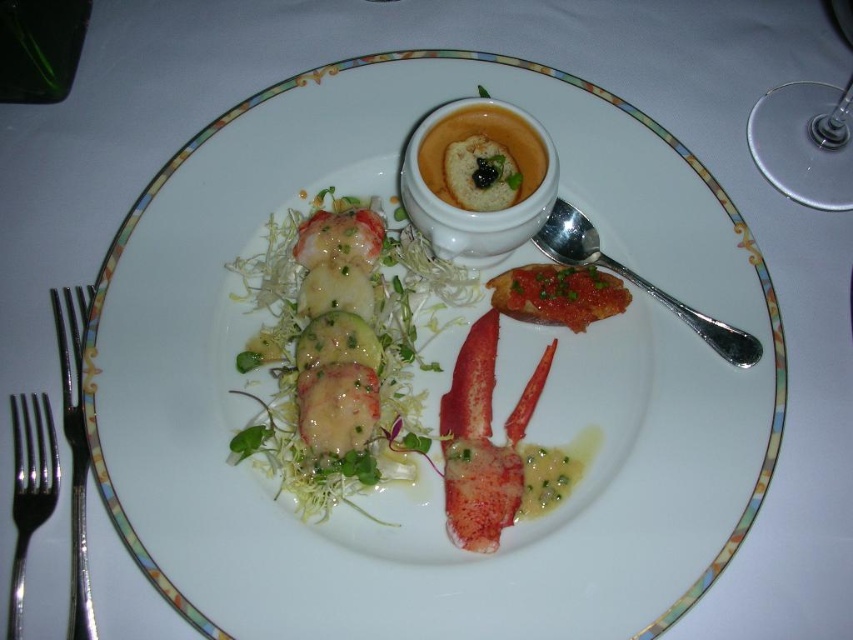
Is satin silver fork at left in front of satin silver spoon at right?

Yes.

The width and height of the screenshot is (853, 640). What do you see at coordinates (28, 486) in the screenshot? I see `satin silver fork at left` at bounding box center [28, 486].

Does point (44, 406) come farther from viewer compared to point (685, 323)?

No.

Find the location of a particular element. This screenshot has width=853, height=640. satin silver fork at left is located at coordinates (28, 486).

From the picture: Who is taller, silver metallic fork at left or matte white bowl at center?

silver metallic fork at left is taller.

Which is behind, point (65, 353) or point (496, 122)?

The point (496, 122) is behind.

The height and width of the screenshot is (640, 853). What are the coordinates of `silver metallic fork at left` in the screenshot? It's located at (74, 458).

Is point (270, 285) closer to camera compared to point (572, 227)?

Yes, point (270, 285) is closer to viewer.

Between point (381, 218) and point (618, 262), which one is positioned in front?

Positioned in front is point (618, 262).

Which is behind, point (311, 304) or point (709, 339)?

The point (311, 304) is behind.

This screenshot has width=853, height=640. I want to click on slightly translucent yellowish salad at center, so click(339, 349).